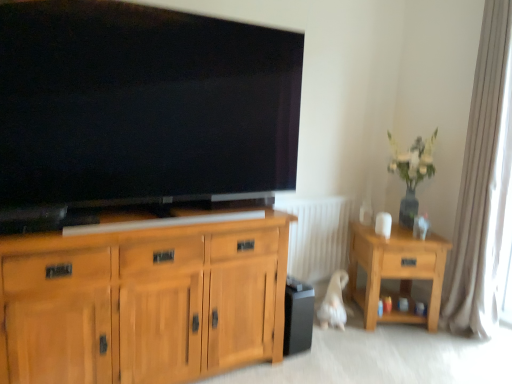
Question: Should I look upward or downward to see white plastic radiator at center?

Choices:
 (A) down
 (B) up

Answer: (A)

Question: Would you say black matte speaker at lower center contains light oak wooden side table at right?

Choices:
 (A) yes
 (B) no

Answer: (B)

Question: Considering the relative sizes of black matte speaker at lower center and light oak wooden side table at right in the image provided, is black matte speaker at lower center wider than light oak wooden side table at right?

Choices:
 (A) yes
 (B) no

Answer: (B)

Question: Can we say black matte speaker at lower center lies outside light oak wooden side table at right?

Choices:
 (A) yes
 (B) no

Answer: (A)

Question: Can you see black matte speaker at lower center touching light oak wooden side table at right?

Choices:
 (A) no
 (B) yes

Answer: (A)

Question: Are black matte speaker at lower center and light oak wooden side table at right far apart?

Choices:
 (A) no
 (B) yes

Answer: (A)

Question: From the image's perspective, is black matte speaker at lower center located above light oak wooden side table at right?

Choices:
 (A) yes
 (B) no

Answer: (B)

Question: Is green glossy vase at upper right facing away from black glossy tv at upper center?

Choices:
 (A) yes
 (B) no

Answer: (B)

Question: Considering the relative positions of green glossy vase at upper right and black glossy tv at upper center in the image provided, is green glossy vase at upper right to the left of black glossy tv at upper center from the viewer's perspective?

Choices:
 (A) no
 (B) yes

Answer: (A)

Question: Is green glossy vase at upper right shorter than black glossy tv at upper center?

Choices:
 (A) yes
 (B) no

Answer: (A)

Question: Can you confirm if green glossy vase at upper right is taller than black glossy tv at upper center?

Choices:
 (A) yes
 (B) no

Answer: (B)

Question: Is green glossy vase at upper right positioned far away from black glossy tv at upper center?

Choices:
 (A) no
 (B) yes

Answer: (B)

Question: Can we say green glossy vase at upper right lies outside black glossy tv at upper center?

Choices:
 (A) yes
 (B) no

Answer: (A)

Question: From a real-world perspective, does light oak wooden side table at right stand above white fabric curtain at right?

Choices:
 (A) no
 (B) yes

Answer: (A)